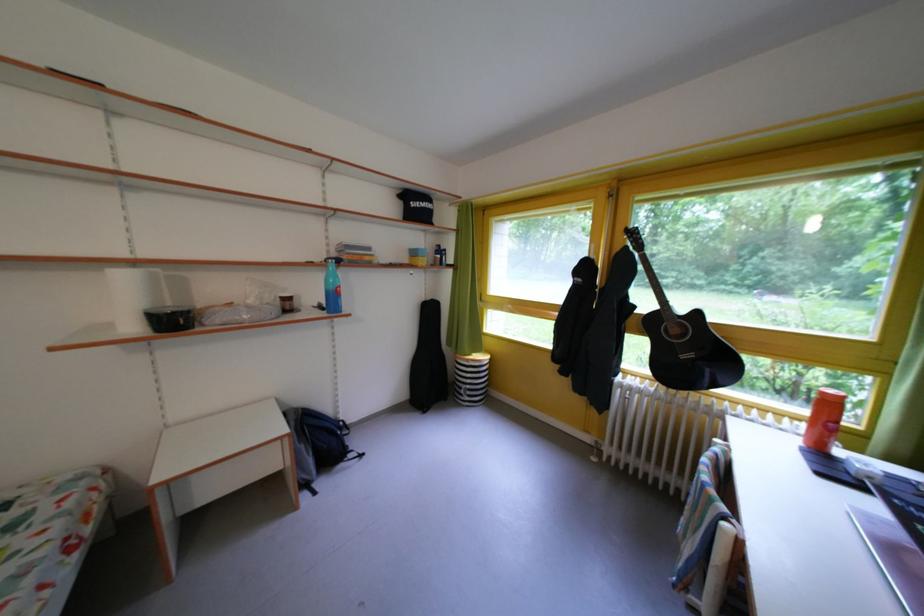
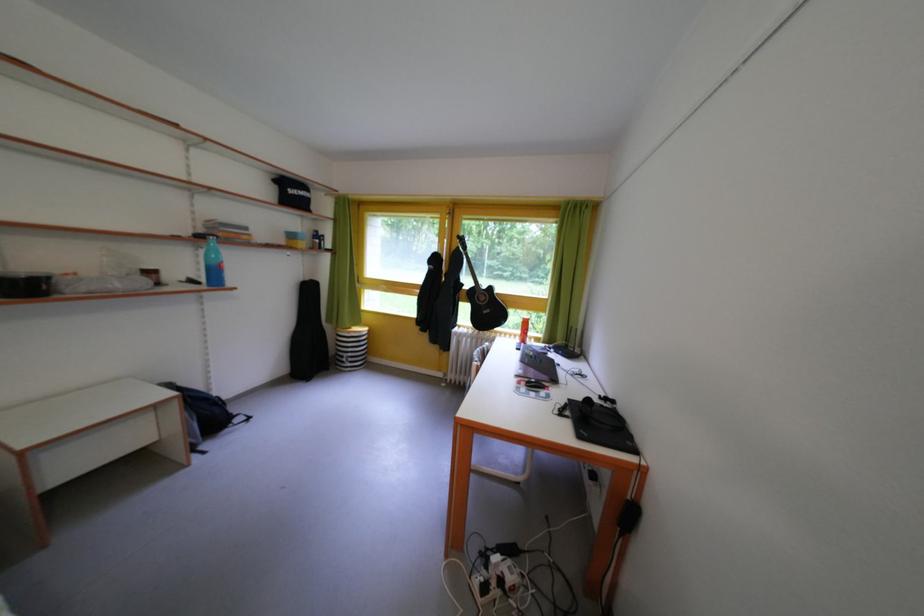
Question: What movement of the cameraman would produce the second image?

Choices:
 (A) Left
 (B) Right
 (C) Forward
 (D) Backward

Answer: (D)